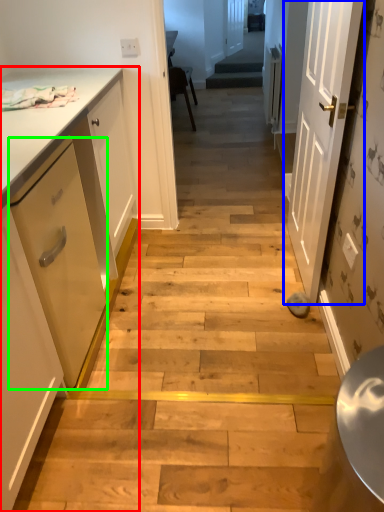
Question: Based on their relative distances, which object is nearer to cabinetry (highlighted by a red box)? Choose from door (highlighted by a blue box) and drawer (highlighted by a green box).

Choices:
 (A) door
 (B) drawer

Answer: (B)